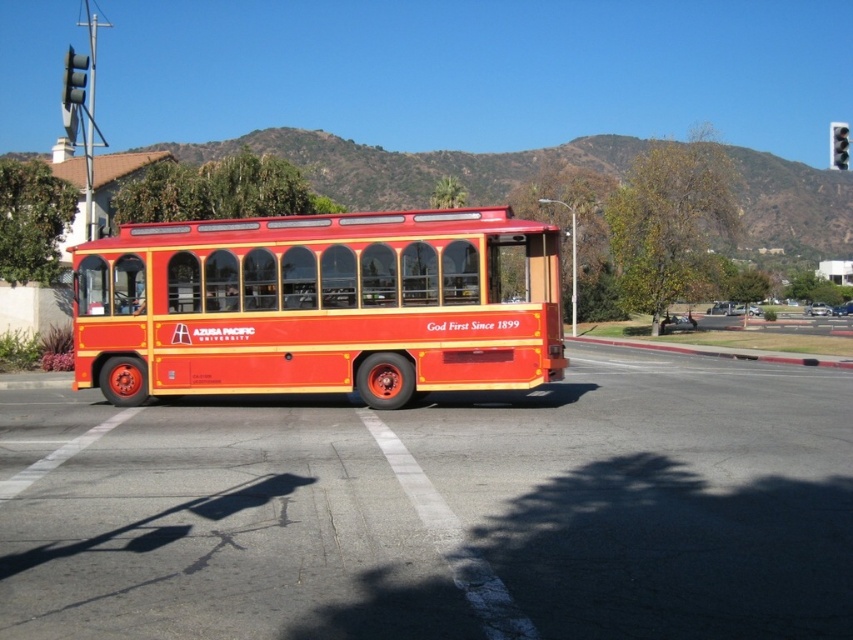
Which is more to the right, shiny red bus at center or black plastic traffic light at upper right?

black plastic traffic light at upper right

Between shiny red bus at center and black plastic traffic light at upper right, which one is positioned lower?

shiny red bus at center is lower down.

Is point (338, 323) positioned behind point (831, 132)?

No, (338, 323) is in front of (831, 132).

The image size is (853, 640). In order to click on shiny red bus at center in this screenshot , I will do `click(317, 307)`.

Which is above, shiny red bus at center or black glass traffic light at upper left?

black glass traffic light at upper left is above.

Where is `shiny red bus at center`? This screenshot has height=640, width=853. shiny red bus at center is located at coordinates (317, 307).

Is black glass traffic light at upper left wider than black plastic traffic light at upper right?

No, black glass traffic light at upper left is not wider than black plastic traffic light at upper right.

Does black glass traffic light at upper left appear under black plastic traffic light at upper right?

No, black glass traffic light at upper left is not below black plastic traffic light at upper right.

At what (x,y) coordinates should I click in order to perform the action: click on black glass traffic light at upper left. Please return your answer as a coordinate pair (x, y). The height and width of the screenshot is (640, 853). Looking at the image, I should click on [74, 80].